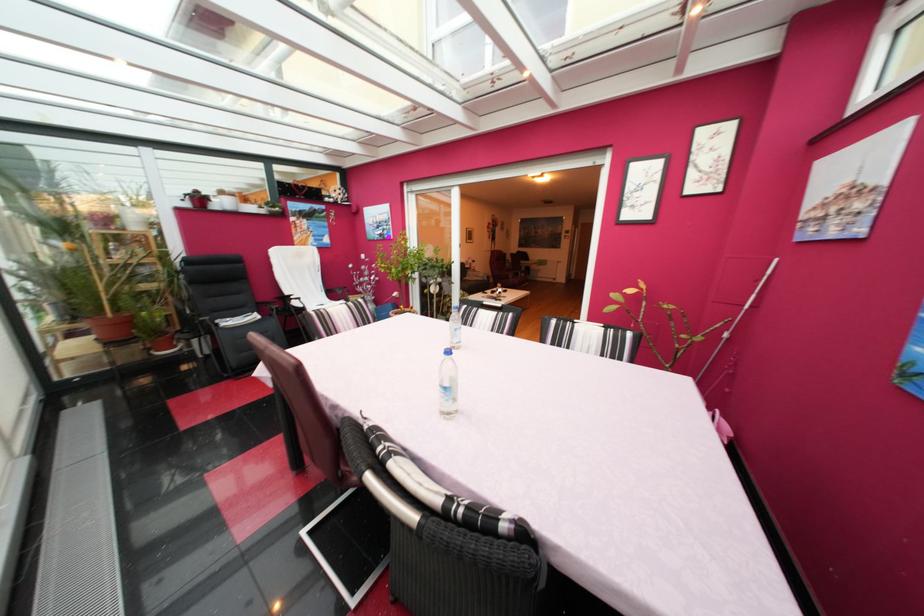
Locate an element on the screen. terracotta plant pot is located at coordinates (112, 326).